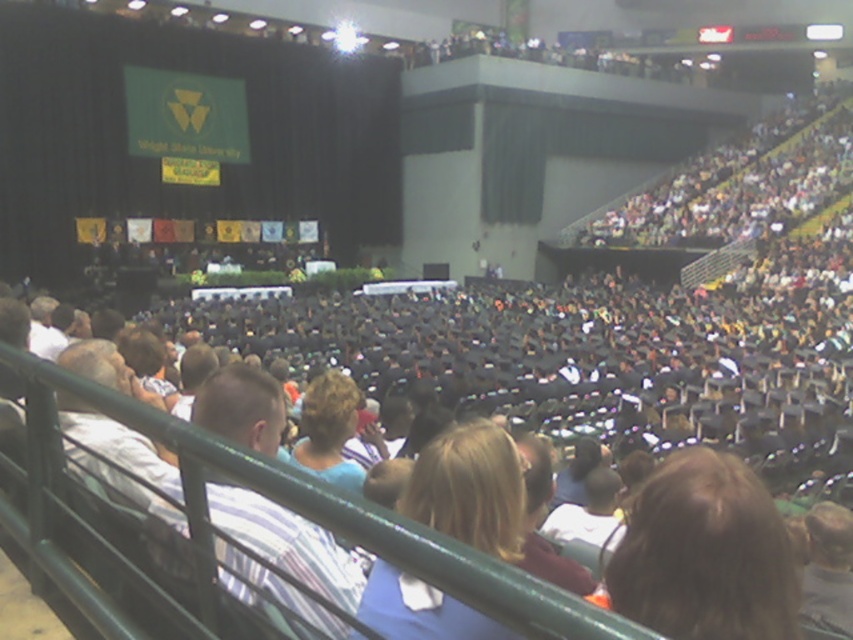
You are standing in the gymnasium and want to locate two specific points marked on the stage. The first point is at coordinates point (756, 564) and the second is at point (395, 579). Which point is closer to you?

Point (756, 564) is closer to the viewer than point (395, 579).